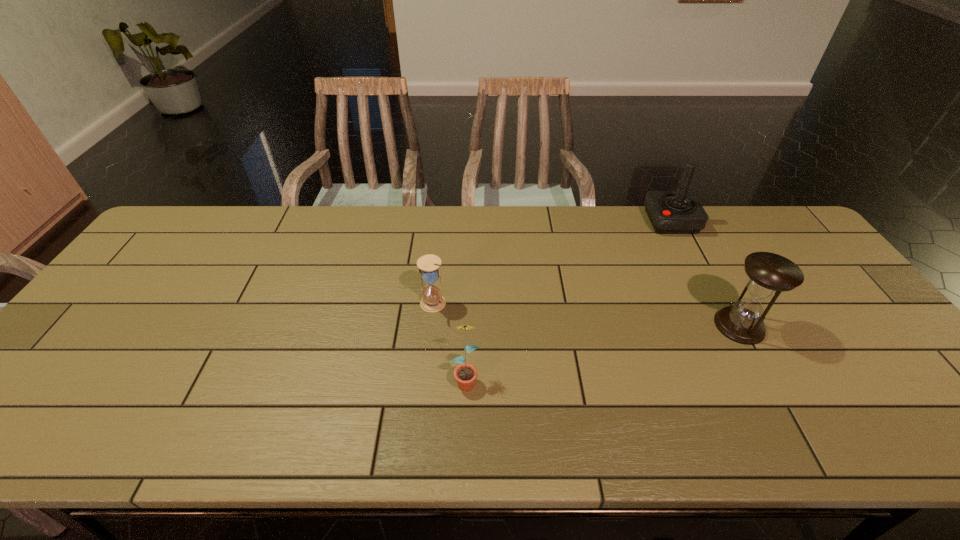
Choose which object is the nearest neighbor to the left hourglass. Please provide its 2D coordinates. Your answer should be formatted as a tuple, i.e. [(x, y)], where the tuple contains the x and y coordinates of a point satisfying the conditions above.

[(465, 374)]

Where is `object that can be found as the second closest to the shorter hourglass`? object that can be found as the second closest to the shorter hourglass is located at coordinates (670, 212).

Where is `vacant region that satisfies the following two spatial constraints: 1. on the front side of the right hourglass; 2. on the left side of the left hourglass`? Image resolution: width=960 pixels, height=540 pixels. vacant region that satisfies the following two spatial constraints: 1. on the front side of the right hourglass; 2. on the left side of the left hourglass is located at coordinates (431, 326).

The height and width of the screenshot is (540, 960). Find the location of `free spot that satisfies the following two spatial constraints: 1. on the front-facing side of the right hourglass; 2. on the left side of the farthest object`. free spot that satisfies the following two spatial constraints: 1. on the front-facing side of the right hourglass; 2. on the left side of the farthest object is located at coordinates (725, 326).

At what (x,y) coordinates should I click in order to perform the action: click on free space that satisfies the following two spatial constraints: 1. on the front-facing side of the joystick; 2. on the back side of the taller hourglass. Please return your answer as a coordinate pair (x, y). The height and width of the screenshot is (540, 960). Looking at the image, I should click on (725, 326).

You are a GUI agent. You are given a task and a screenshot of the screen. Output one action in this format:
    pyautogui.click(x=<x>, y=<y>)
    Task: Click on the vacant area that satisfies the following two spatial constraints: 1. on the front-facing side of the joystick; 2. on the left side of the taller hourglass
    The height and width of the screenshot is (540, 960).
    Given the screenshot: What is the action you would take?
    pyautogui.click(x=725, y=326)

The image size is (960, 540). Find the location of `free spot that satisfies the following two spatial constraints: 1. on the front-facing side of the joystick; 2. on the right side of the taller hourglass`. free spot that satisfies the following two spatial constraints: 1. on the front-facing side of the joystick; 2. on the right side of the taller hourglass is located at coordinates (725, 326).